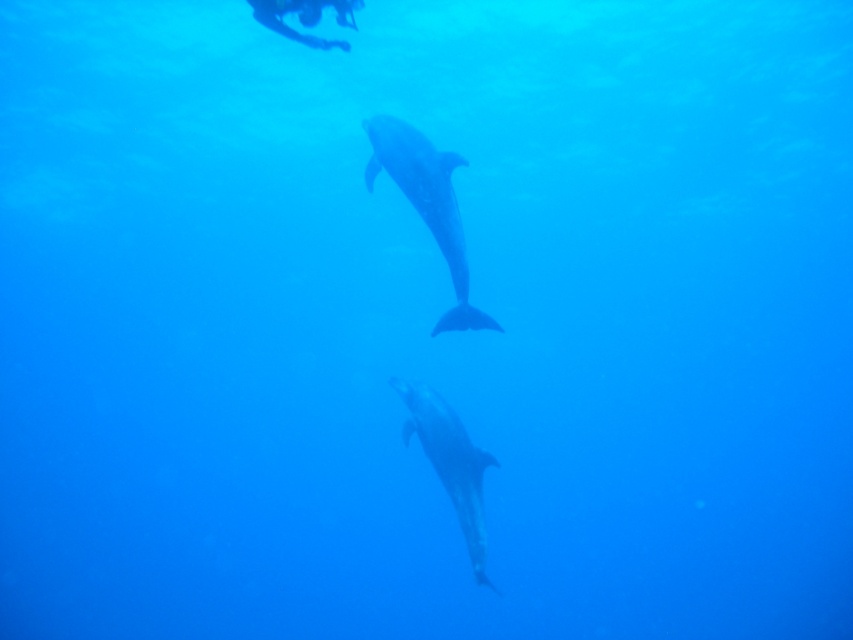
You are a marine biologist observing an underwater scene. You notice a smooth gray dolphin at center. Based on its 2D coordinates, where would you estimate it to be positioned in the image?

The smooth gray dolphin at center is located at the 2D coordinates point (x=427, y=204).

You are a marine biologist observing two dolphins in the ocean. You notice a smooth gray dolphin at center and a glossy dolphin at center. Which dolphin appears taller in the water?

The smooth gray dolphin at center appears taller than the glossy dolphin at center because the description states it is much taller.